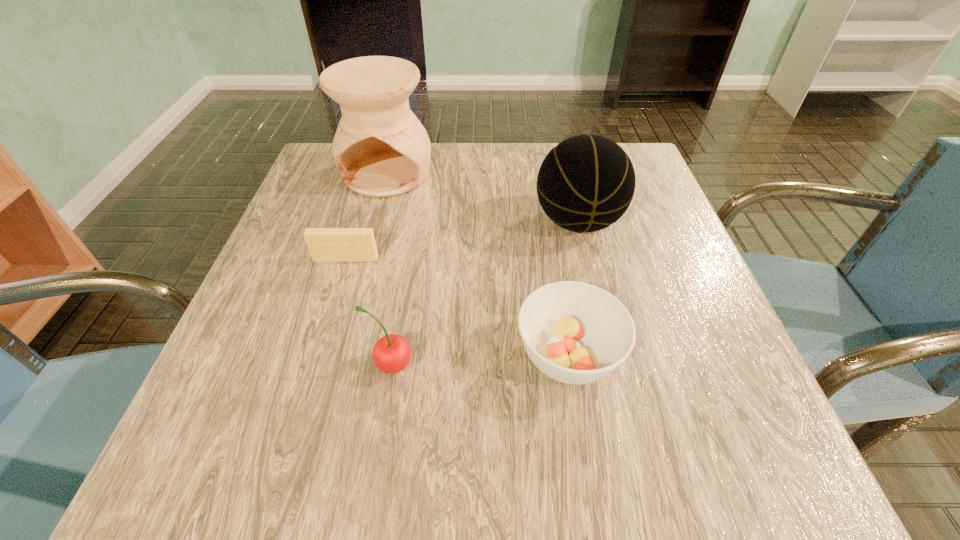
This screenshot has height=540, width=960. I want to click on vacant region located 0.350m at the front of the videotape with spools, so 289,446.

Find the location of `pottery positioned at the far edge`. pottery positioned at the far edge is located at coordinates (381, 149).

Image resolution: width=960 pixels, height=540 pixels. I want to click on basketball that is at the far edge, so click(586, 183).

Identify the location of pottery that is at the left edge. The image size is (960, 540). (381, 149).

Image resolution: width=960 pixels, height=540 pixels. What are the coordinates of `videotape situated at the left edge` in the screenshot? It's located at (325, 244).

Identify the location of object present at the right edge. (586, 183).

The width and height of the screenshot is (960, 540). Find the location of `object that is at the far left corner`. object that is at the far left corner is located at coordinates (381, 149).

You are a GUI agent. You are given a task and a screenshot of the screen. Output one action in this format:
    pyautogui.click(x=<x>, y=<y>)
    Task: Click on the object located in the far right corner section of the desktop
    
    Given the screenshot: What is the action you would take?
    pyautogui.click(x=586, y=183)

This screenshot has height=540, width=960. What are the coordinates of `vacant space at the far edge` in the screenshot? It's located at (460, 146).

At what (x,y) coordinates should I click in order to perform the action: click on vacant space at the near edge of the desktop. Please return your answer as a coordinate pair (x, y). Looking at the image, I should click on (492, 461).